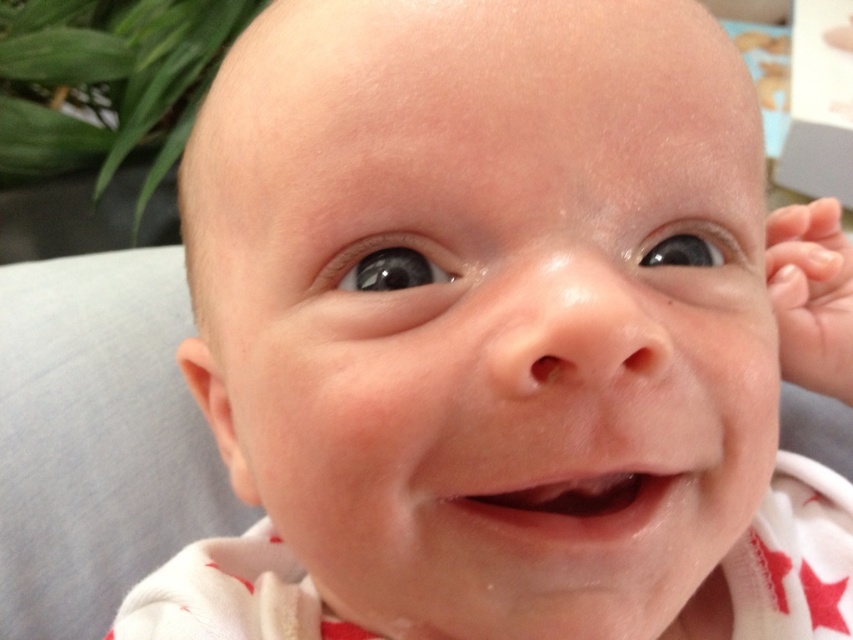
You are an AI analyzing the position of the baby in the image. The image coordinate system has its origin at the bottom left corner. What are the coordinates of the smooth skin baby at center?

The coordinates of the smooth skin baby at center are at point (x=494, y=308).

You are a photographer adjusting the focus of your camera. You have two points to focus on in the image of the baby. The first point is at point (x=460, y=472) and the second is at point (x=834, y=237). Which point should you focus on to ensure the baby is in focus?

You should focus on point (x=460, y=472) because it is in front of point (x=834, y=237), meaning it is closer to the camera and thus the baby is more likely to be in focus there.

Based on the scene description, which object, the pale skin hand at right or the smooth flesh mouth at center, occupies a greater area in the image?

The pale skin hand at right has a larger size compared to the smooth flesh mouth at center, so it occupies a greater area in the image.